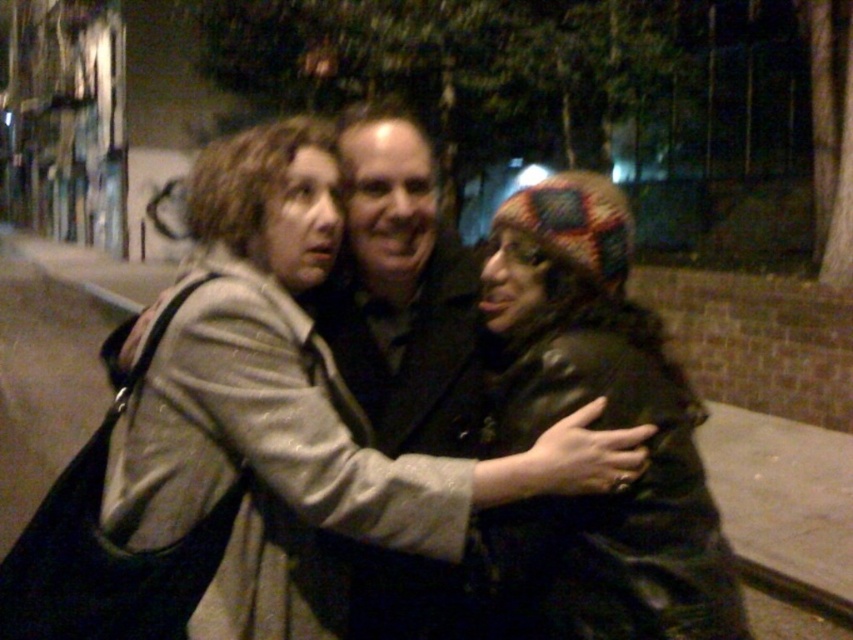
Is knitted multicolor hat at center closer to the viewer compared to black matte jacket at center?

Yes, it is in front of black matte jacket at center.

Where is `knitted multicolor hat at center`? knitted multicolor hat at center is located at coordinates (596, 428).

The height and width of the screenshot is (640, 853). Identify the location of knitted multicolor hat at center. (596, 428).

Does matte gray coat at center appear on the right side of black matte jacket at center?

Yes, matte gray coat at center is to the right of black matte jacket at center.

Can you confirm if matte gray coat at center is positioned below black matte jacket at center?

Yes.

Where is `matte gray coat at center`? matte gray coat at center is located at coordinates (519, 406).

Does matte gray coat at center have a smaller size compared to knitted multicolor hat at center?

Actually, matte gray coat at center might be larger than knitted multicolor hat at center.

Is matte gray coat at center to the left of knitted multicolor hat at center from the viewer's perspective?

Indeed, matte gray coat at center is positioned on the left side of knitted multicolor hat at center.

You are a GUI agent. You are given a task and a screenshot of the screen. Output one action in this format:
    pyautogui.click(x=<x>, y=<y>)
    Task: Click on the matte gray coat at center
    
    Given the screenshot: What is the action you would take?
    [519, 406]